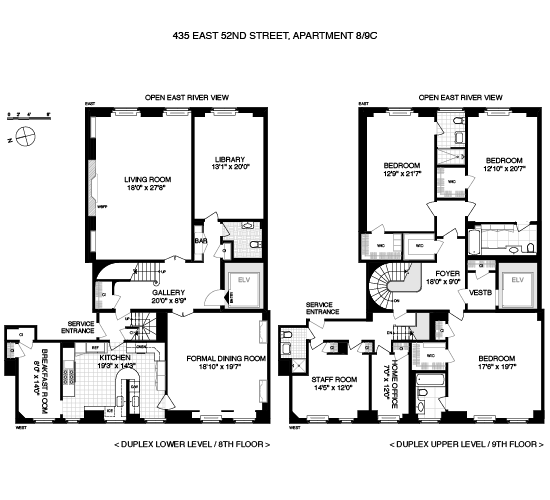
Locate an element on the screen. bedroom area is located at coordinates click(x=416, y=174), click(x=499, y=362), click(x=510, y=175).